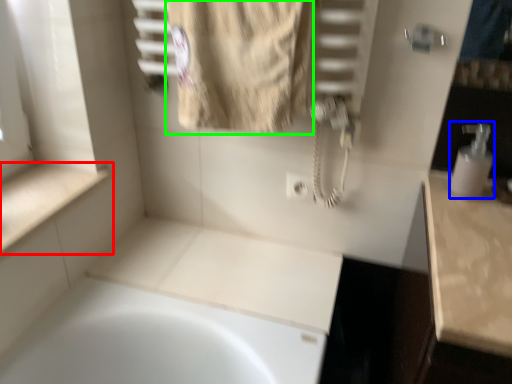
Question: Based on their relative distances, which object is nearer to counter top (highlighted by a red box)? Choose from soap dispenser (highlighted by a blue box) and bath towel (highlighted by a green box).

Choices:
 (A) soap dispenser
 (B) bath towel

Answer: (B)